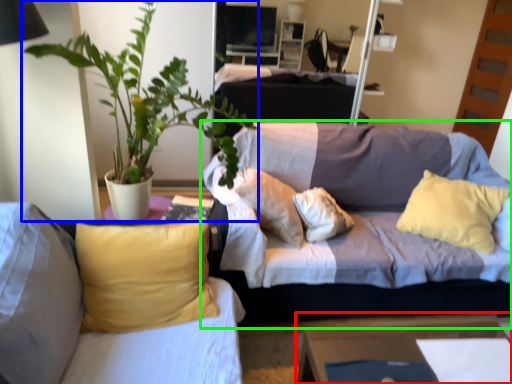
Question: Based on their relative distances, which object is farther from table (highlighted by a red box)? Choose from houseplant (highlighted by a blue box) and studio couch (highlighted by a green box).

Choices:
 (A) houseplant
 (B) studio couch

Answer: (A)